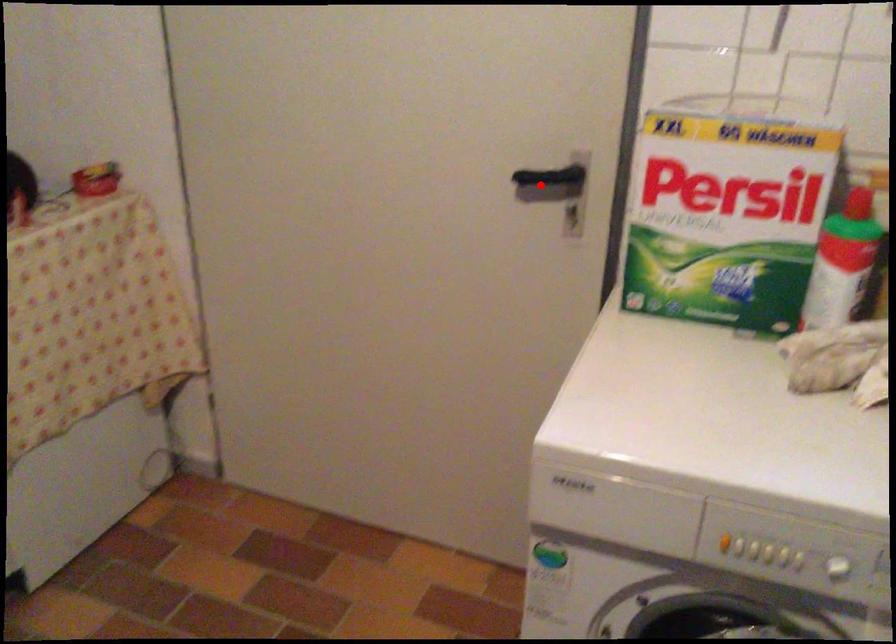
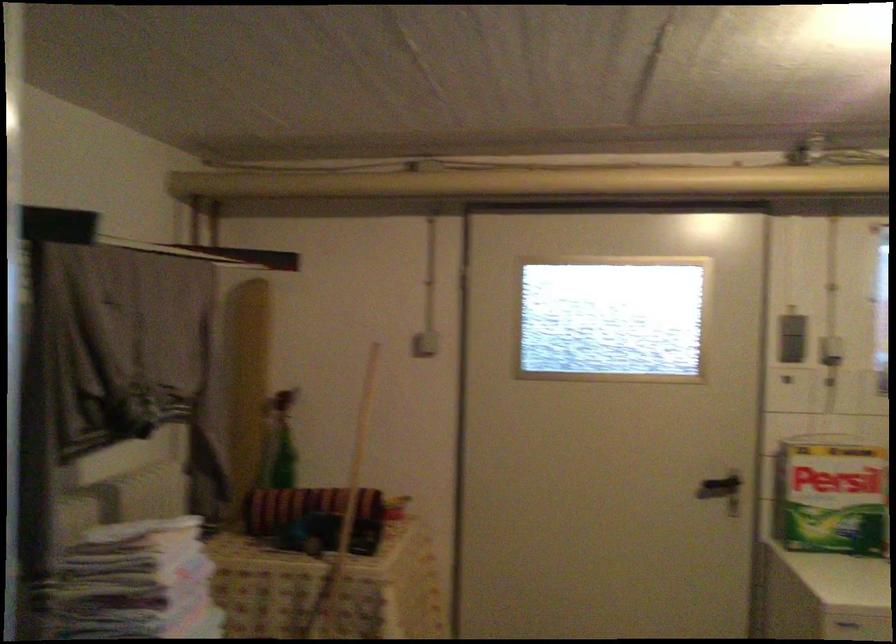
Locate, in the second image, the point that corresponds to the highlighted location in the first image.

(720, 488)